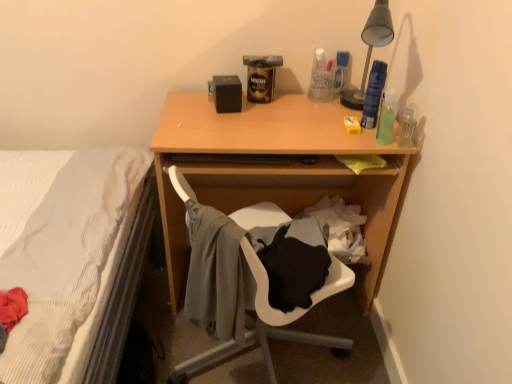
Question: Can you confirm if translucent plastic spray can at upper right, positioned as the second bottle in back-to-front order, is thinner than black matte speaker at upper center?

Choices:
 (A) no
 (B) yes

Answer: (B)

Question: Is translucent plastic spray can at upper right, marked as the 3th bottle in a front-to-back arrangement, positioned behind black matte speaker at upper center?

Choices:
 (A) yes
 (B) no

Answer: (B)

Question: Is translucent plastic spray can at upper right, marked as the 3th bottle in a front-to-back arrangement, bigger than black matte speaker at upper center?

Choices:
 (A) yes
 (B) no

Answer: (B)

Question: From a real-world perspective, is translucent plastic spray can at upper right, marked as the 3th bottle in a front-to-back arrangement, over black matte speaker at upper center?

Choices:
 (A) yes
 (B) no

Answer: (A)

Question: Can you confirm if translucent plastic spray can at upper right, positioned as the second bottle in back-to-front order, is taller than black matte speaker at upper center?

Choices:
 (A) yes
 (B) no

Answer: (A)

Question: From the image's perspective, is clear plastic bottle at right, the second bottle from the front, located above or below translucent green bottle at right, marked as the 1th bottle in a front-to-back arrangement?

Choices:
 (A) above
 (B) below

Answer: (B)

Question: Is point (409, 120) positioned closer to the camera than point (392, 110)?

Choices:
 (A) farther
 (B) closer

Answer: (B)

Question: Is clear plastic bottle at right, which is the 3th bottle in back-to-front order, in front of or behind translucent green bottle at right, arranged as the fourth bottle when viewed from the back, in the image?

Choices:
 (A) front
 (B) behind

Answer: (B)

Question: Considering the positions of clear plastic bottle at right, which is the 3th bottle in back-to-front order, and translucent green bottle at right, arranged as the fourth bottle when viewed from the back, in the image, is clear plastic bottle at right, which is the 3th bottle in back-to-front order, taller or shorter than translucent green bottle at right, arranged as the fourth bottle when viewed from the back,?

Choices:
 (A) short
 (B) tall

Answer: (A)

Question: Considering the positions of point pyautogui.click(x=381, y=82) and point pyautogui.click(x=403, y=135), is point pyautogui.click(x=381, y=82) closer or farther from the camera than point pyautogui.click(x=403, y=135)?

Choices:
 (A) closer
 (B) farther

Answer: (B)

Question: Is translucent plastic spray can at upper right, marked as the 3th bottle in a front-to-back arrangement, to the left or to the right of clear plastic bottle at right, which is the 3th bottle in back-to-front order, in the image?

Choices:
 (A) left
 (B) right

Answer: (A)

Question: Is translucent plastic spray can at upper right, marked as the 3th bottle in a front-to-back arrangement, wider or thinner than clear plastic bottle at right, which is the 3th bottle in back-to-front order?

Choices:
 (A) wide
 (B) thin

Answer: (B)

Question: Is translucent plastic spray can at upper right, positioned as the second bottle in back-to-front order, inside or outside of clear plastic bottle at right, the second bottle from the front?

Choices:
 (A) outside
 (B) inside

Answer: (A)

Question: Is point (337, 56) positioned closer to the camera than point (408, 112)?

Choices:
 (A) farther
 (B) closer

Answer: (A)

Question: Is translucent plastic bottle at upper right, which is the fourth bottle from front to back, situated inside clear plastic bottle at right, the second bottle from the front, or outside?

Choices:
 (A) outside
 (B) inside

Answer: (A)